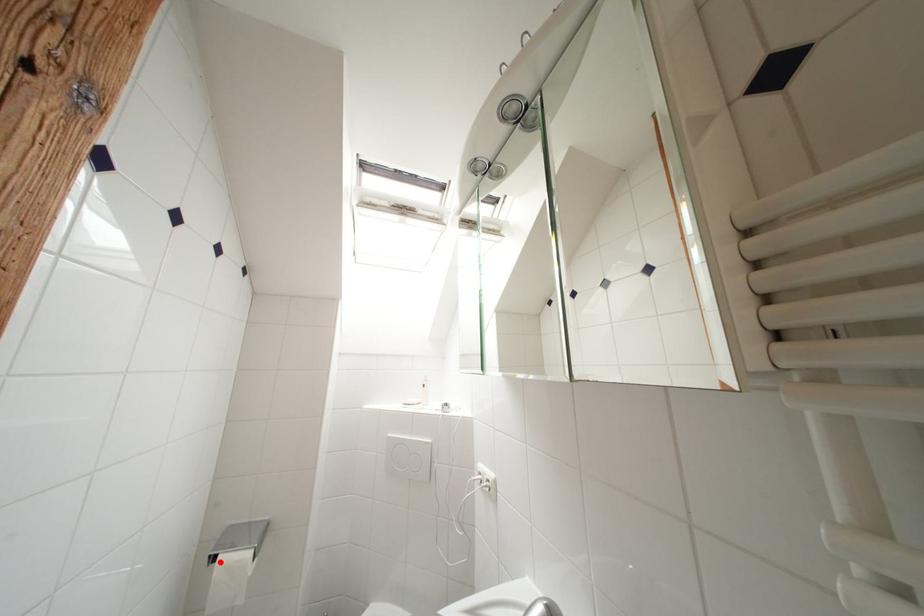
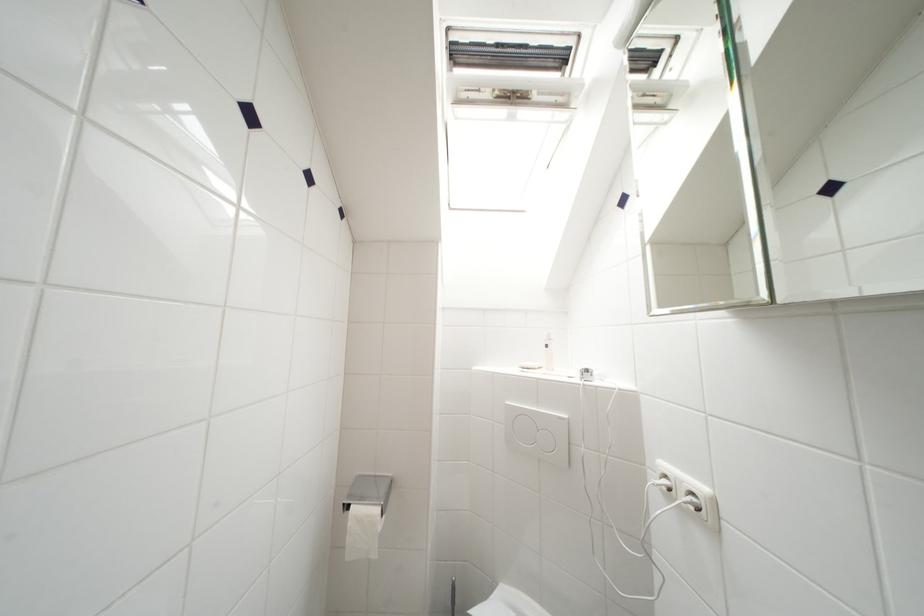
Question: I am providing you with two images of the same scene from different viewpoints. In image1, a red point is highlighted. Considering the same 3D point in image2, which of the following is correct?

Choices:
 (A) It is closer
 (B) It is farther

Answer: (B)